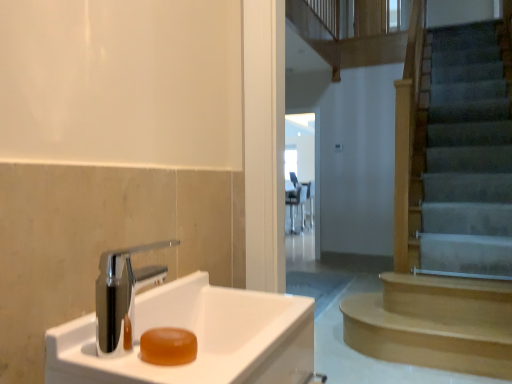
Question: Considering the positions of point (302, 168) and point (126, 354), is point (302, 168) closer or farther from the camera than point (126, 354)?

Choices:
 (A) closer
 (B) farther

Answer: (B)

Question: In terms of width, does transparent glass door at center look wider or thinner when compared to white glossy sink at lower left?

Choices:
 (A) wide
 (B) thin

Answer: (B)

Question: Estimate the real-world distances between objects in this image. Which object is farther from the translucent amber soap at sink left?

Choices:
 (A) white glossy sink at lower left
 (B) transparent glass door at center
 (C) light brown wooden stairs at right

Answer: (B)

Question: Which is farther from the white glossy sink at lower left?

Choices:
 (A) translucent amber soap at sink left
 (B) transparent glass door at center
 (C) light brown wooden stairs at right

Answer: (B)